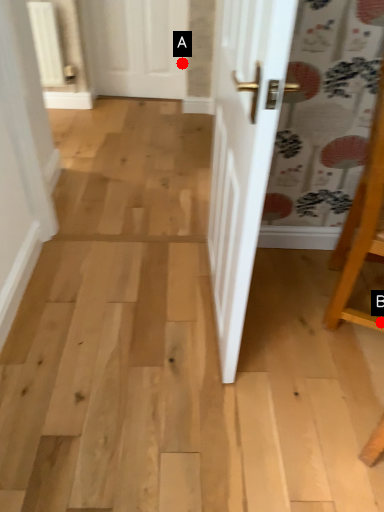
Question: Two points are circled on the image, labeled by A and B beside each circle. Which point is closer to the camera?

Choices:
 (A) A is closer
 (B) B is closer

Answer: (B)